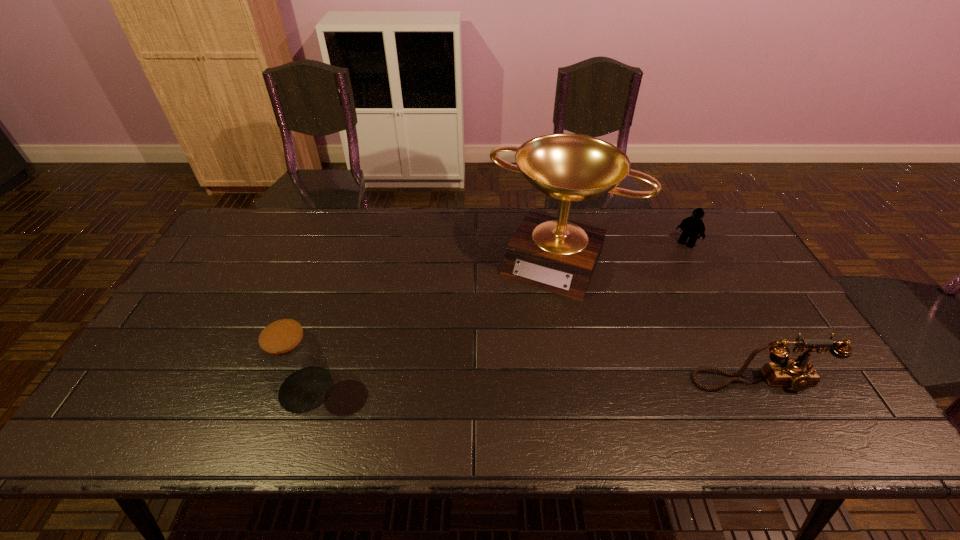
The image size is (960, 540). Identify the location of vacant region between the Lego and the tallest object. (622, 252).

Where is `empty location between the Lego and the leftmost object`? Image resolution: width=960 pixels, height=540 pixels. empty location between the Lego and the leftmost object is located at coordinates (496, 316).

The width and height of the screenshot is (960, 540). Identify the location of unoccupied area between the telephone and the jar. (533, 385).

Identify the location of vacant region between the telephone and the Lego. The image size is (960, 540). (723, 312).

Image resolution: width=960 pixels, height=540 pixels. I want to click on vacant space that's between the Lego and the leftmost object, so (x=496, y=316).

Image resolution: width=960 pixels, height=540 pixels. I want to click on object that is the third closest to the award, so click(290, 357).

The height and width of the screenshot is (540, 960). Identify the location of the third closest object to the telephone. (290, 357).